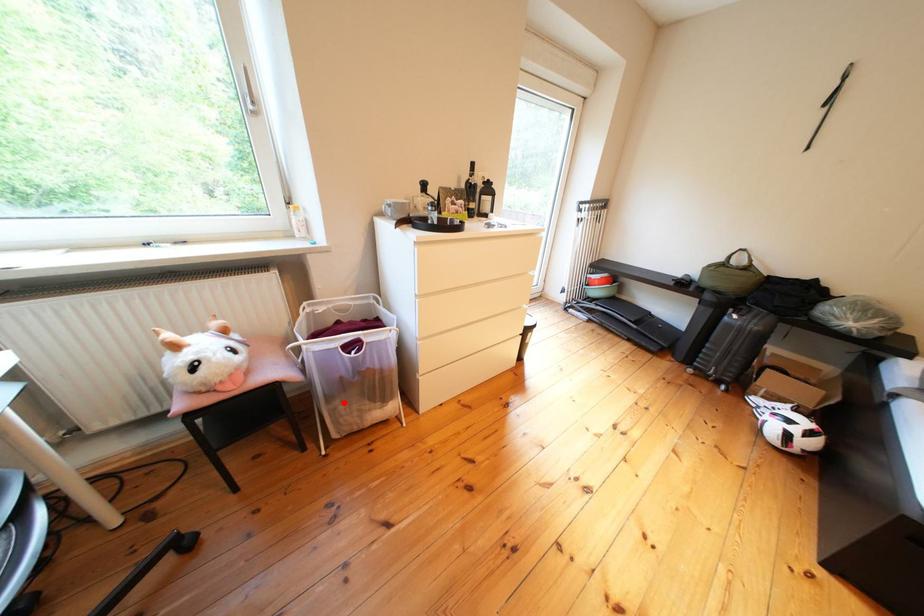
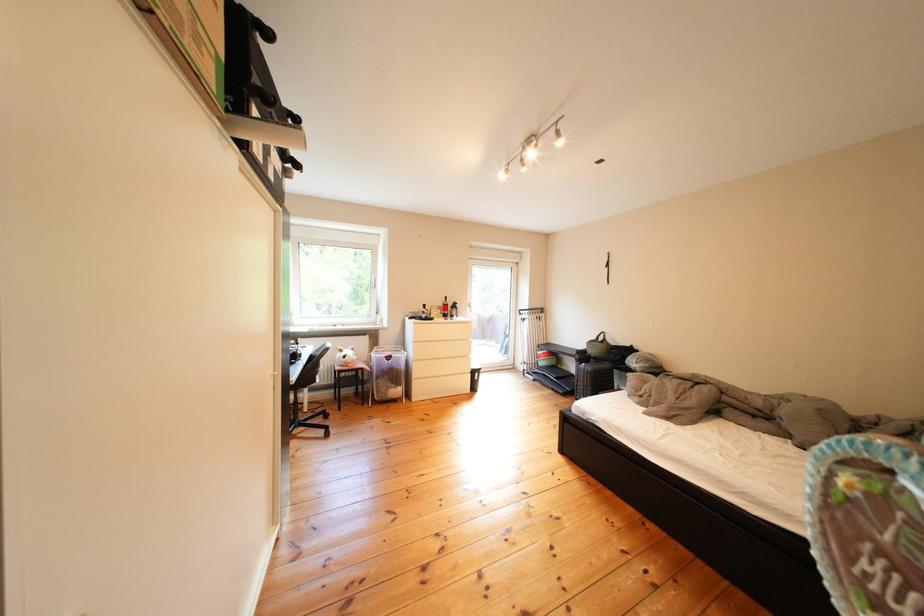
I am providing you with two images of the same scene from different viewpoints. A red point is marked on the first image and another point is marked on the second image. Is the marked point in image1 the same physical position as the marked point in image2?

No